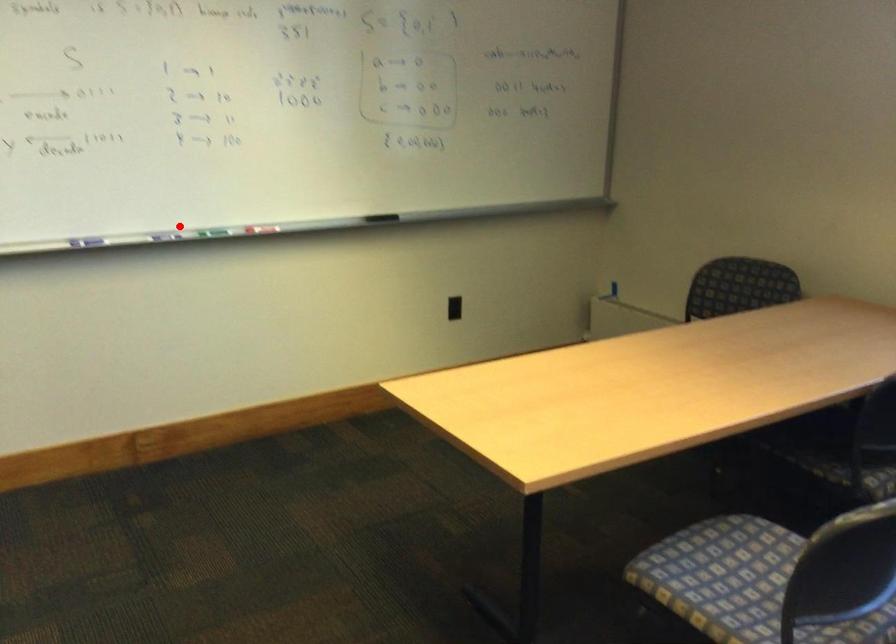
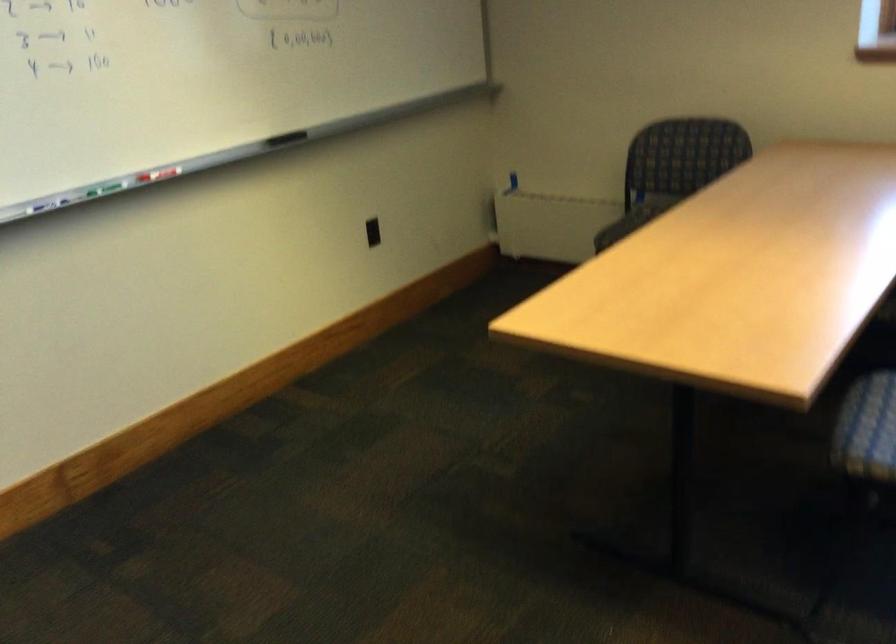
In the second image, find the point that corresponds to the highlighted location in the first image.

(65, 194)